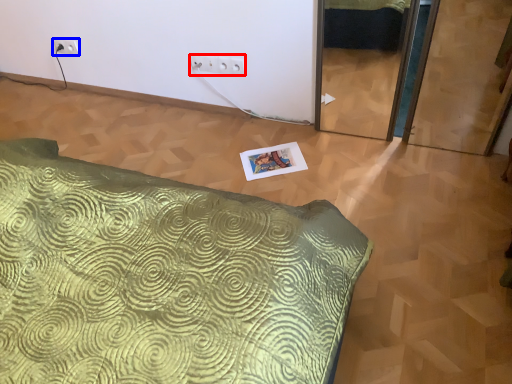
Question: Which of the following is the farthest to the observer, electric outlet (highlighted by a red box) or electric outlet (highlighted by a blue box)?

Choices:
 (A) electric outlet
 (B) electric outlet

Answer: (B)